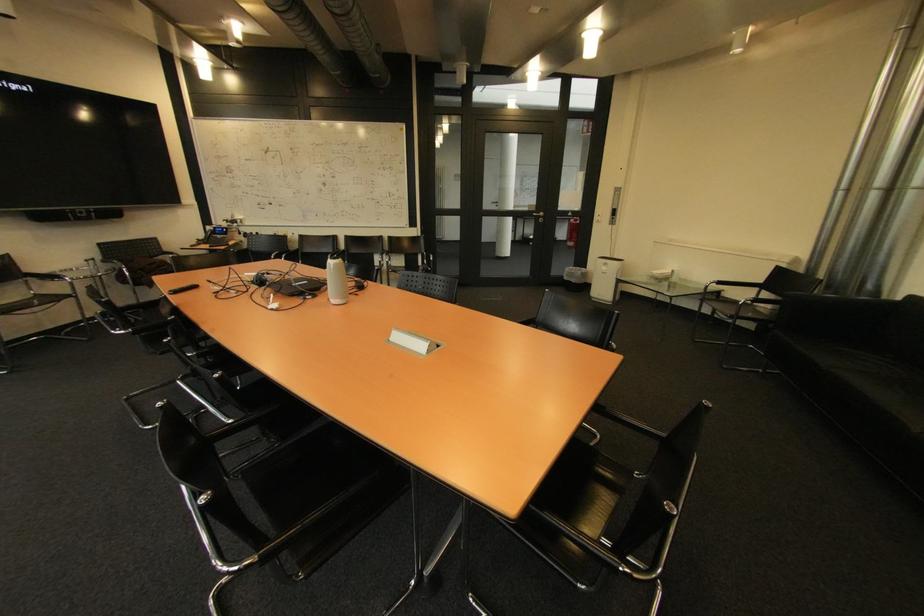
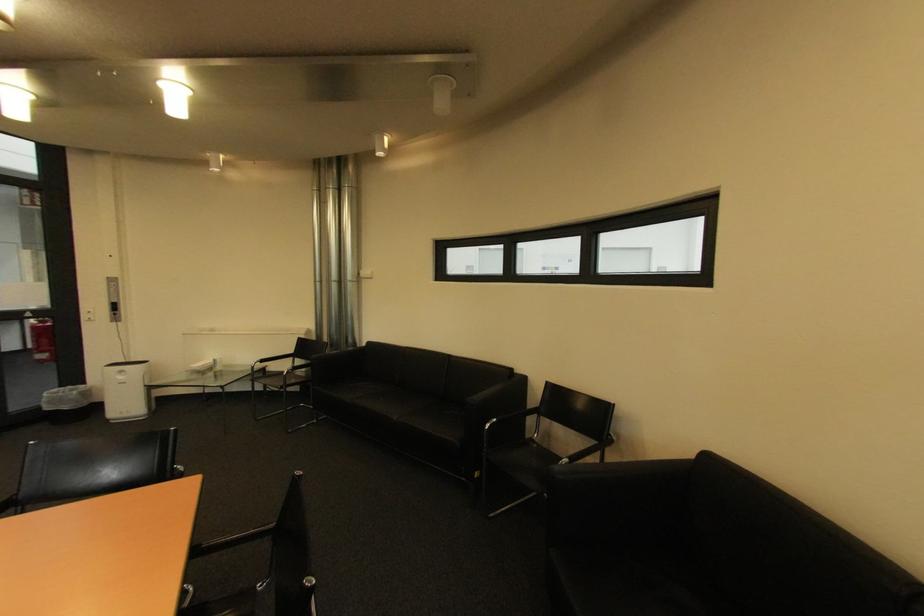
Question: The camera is either moving clockwise (left) or counter-clockwise (right) around the object. The first image is from the beginning of the video and the second image is from the end. Is the camera moving left or right when shooting the video?

Choices:
 (A) Left
 (B) Right

Answer: (A)